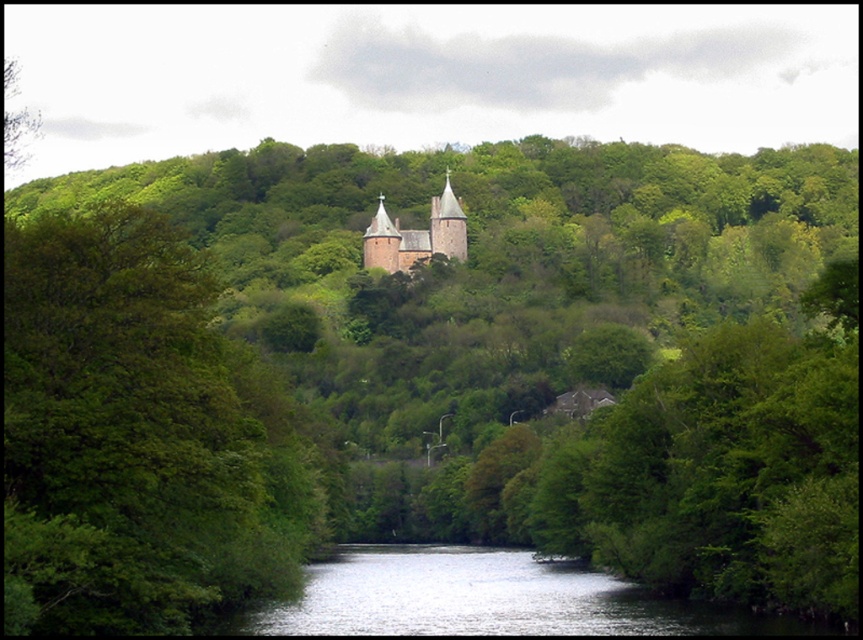
Question: Can you confirm if green leafy tree at center is positioned below smooth stone church at center?

Choices:
 (A) no
 (B) yes

Answer: (B)

Question: Can you confirm if green leafy tree at center is smaller than smooth stone church at center?

Choices:
 (A) yes
 (B) no

Answer: (B)

Question: Which of the following is the farthest from the observer?

Choices:
 (A) (197, 536)
 (B) (448, 234)

Answer: (B)

Question: Observing the image, what is the correct spatial positioning of green leafy tree at center in reference to smooth stone church at center?

Choices:
 (A) above
 (B) below

Answer: (B)

Question: Which object is closer to the camera taking this photo?

Choices:
 (A) smooth stone church at center
 (B) green leafy tree at center

Answer: (B)

Question: Which of the following is the closest to the observer?

Choices:
 (A) green leafy tree at center
 (B) smooth stone church at center

Answer: (A)